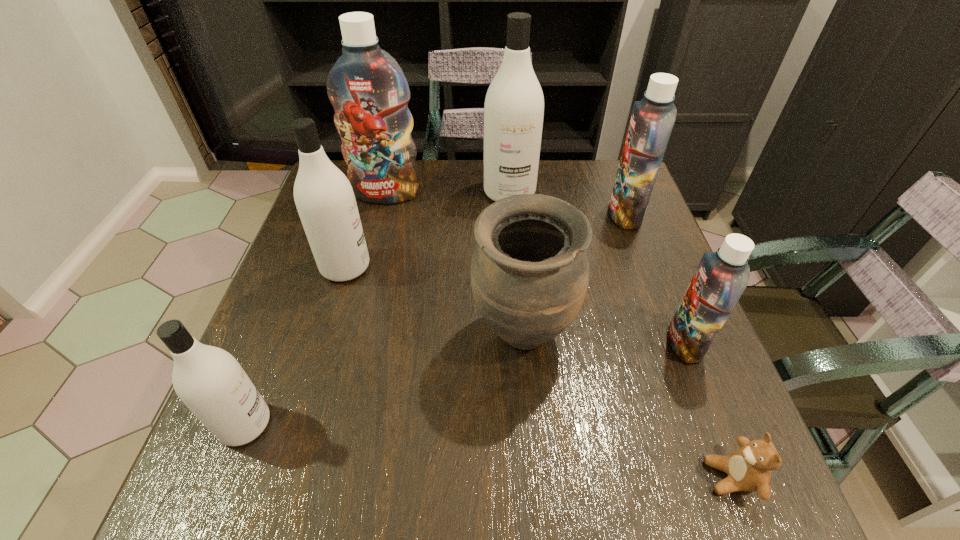
You are a GUI agent. You are given a task and a screenshot of the screen. Output one action in this format:
    pyautogui.click(x=<x>, y=<y>)
    Task: Click on the blank area in the image that satisfies the following two spatial constraints: 1. on the front-facing side of the third shampoo from right to left; 2. on the right side of the urn
    
    Given the screenshot: What is the action you would take?
    pyautogui.click(x=520, y=335)

At what (x,y) coordinates should I click in order to perform the action: click on vacant position in the image that satisfies the following two spatial constraints: 1. on the front-facing side of the urn; 2. on the right side of the second farthest white shampoo. Please return your answer as a coordinate pair (x, y). Image resolution: width=960 pixels, height=540 pixels. Looking at the image, I should click on (325, 335).

You are a GUI agent. You are given a task and a screenshot of the screen. Output one action in this format:
    pyautogui.click(x=<x>, y=<y>)
    Task: Click on the vacant space that satisfies the following two spatial constraints: 1. on the front-facing side of the urn; 2. on the right side of the third nearest shampoo
    
    Given the screenshot: What is the action you would take?
    pyautogui.click(x=325, y=335)